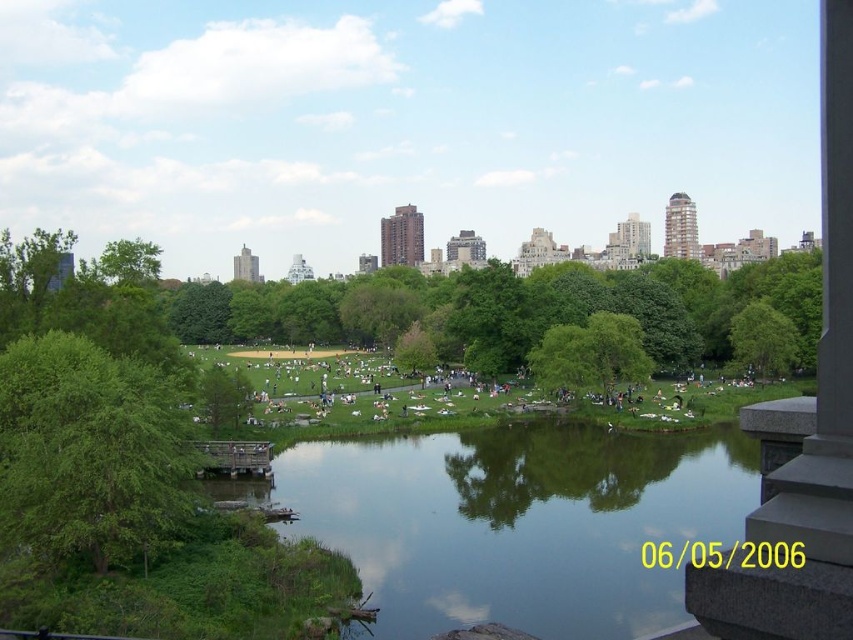
You are standing on the bridge overlooking the park. You see the green grassy river at center and the green leafy tree at left. Which object is positioned to the right of the other?

The green grassy river at center is to the right of the green leafy tree at left.